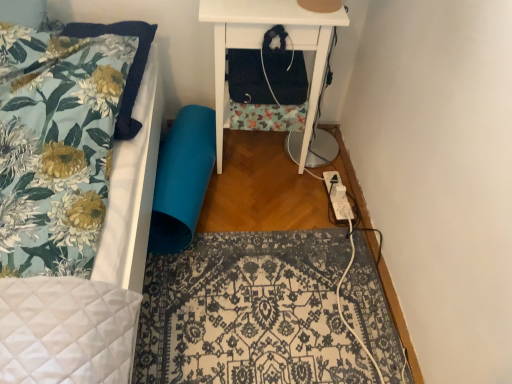
Find the location of a particular element. The height and width of the screenshot is (384, 512). vacant space situated above teal fabric swivel chair at lower left (from a real-world perspective) is located at coordinates (177, 152).